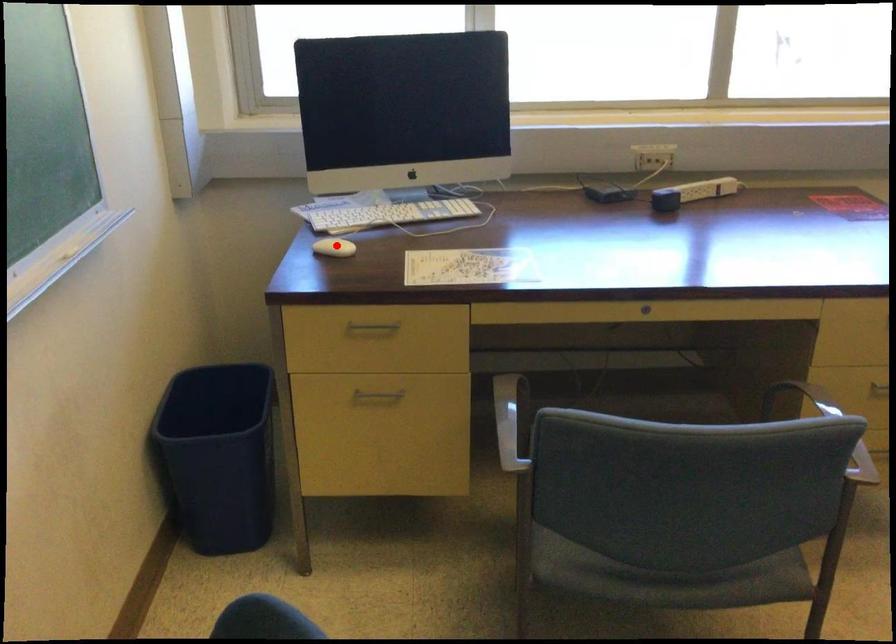
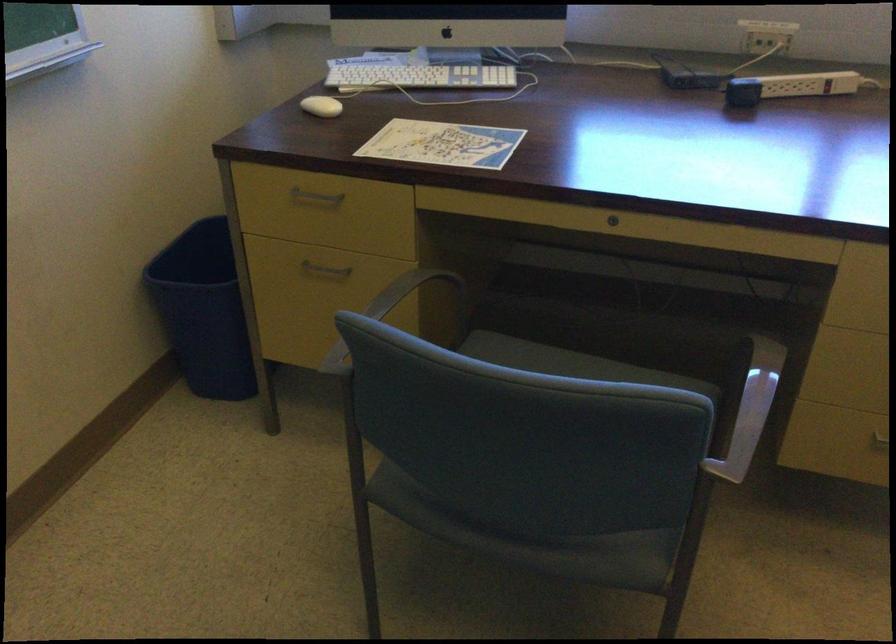
Locate, in the second image, the point that corresponds to the highlighted location in the first image.

(321, 106)